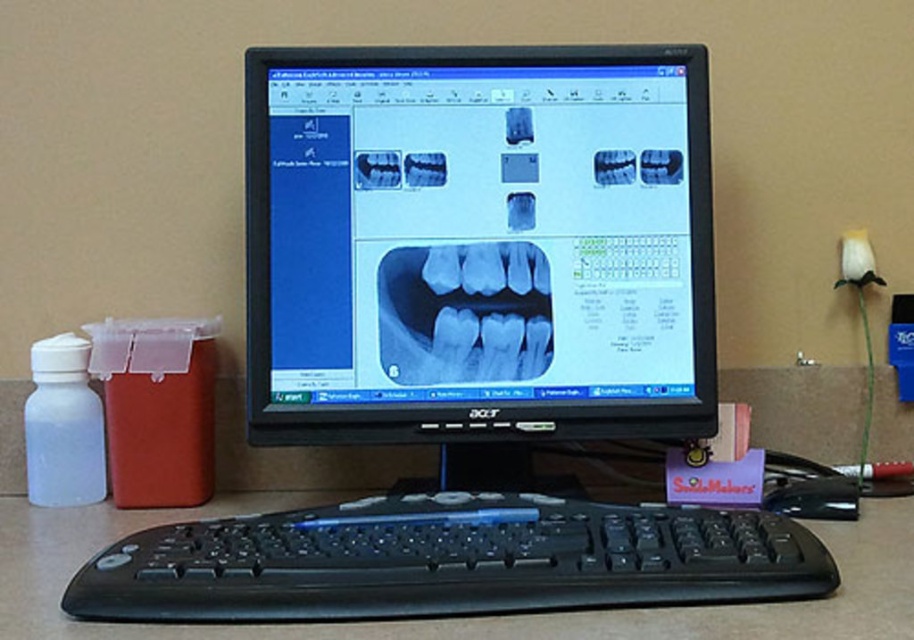
You are a dental technician working at the workstation and need to access both the point at (517, 312) and the point at (86, 472). Which point should you reach for first to minimize the distance traveled?

You should reach for point (517, 312) first because it is closer to your starting position at the workstation compared to point (86, 472).